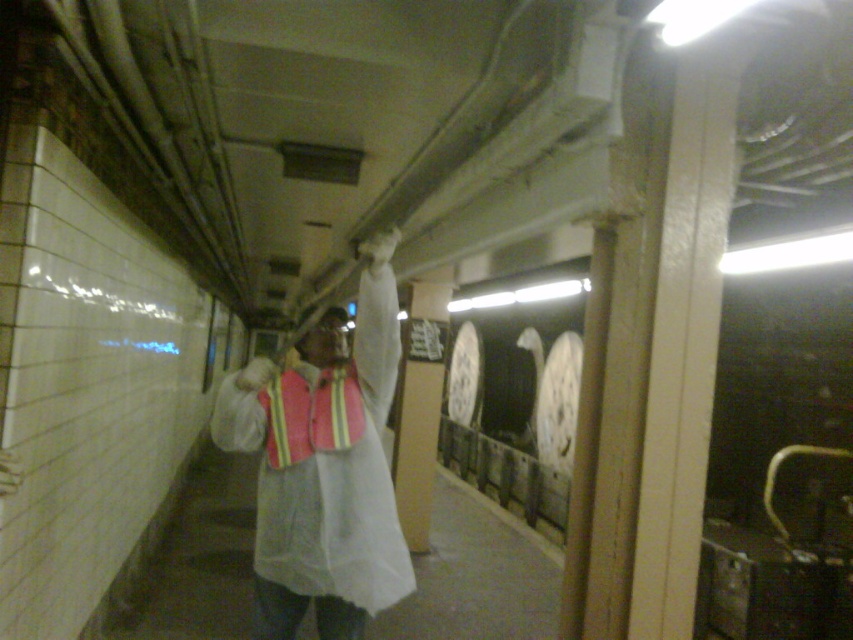
Question: Which object is the closest to the matte white head at center?

Choices:
 (A) reflective fabric safety vest at center
 (B) reflective safety vest at center

Answer: (A)

Question: Among these points, which one is nearest to the camera?

Choices:
 (A) (316, 362)
 (B) (367, 248)
 (C) (310, 426)

Answer: (C)

Question: Can you confirm if reflective safety vest at center is positioned to the left of reflective fabric safety vest at center?

Choices:
 (A) no
 (B) yes

Answer: (A)

Question: Does reflective safety vest at center have a greater width compared to reflective fabric safety vest at center?

Choices:
 (A) yes
 (B) no

Answer: (A)

Question: Does reflective safety vest at center have a greater width compared to reflective fabric safety vest at center?

Choices:
 (A) yes
 (B) no

Answer: (A)

Question: Which object appears farthest from the camera in this image?

Choices:
 (A) reflective safety vest at center
 (B) reflective fabric safety vest at center
 (C) matte white head at center

Answer: (C)